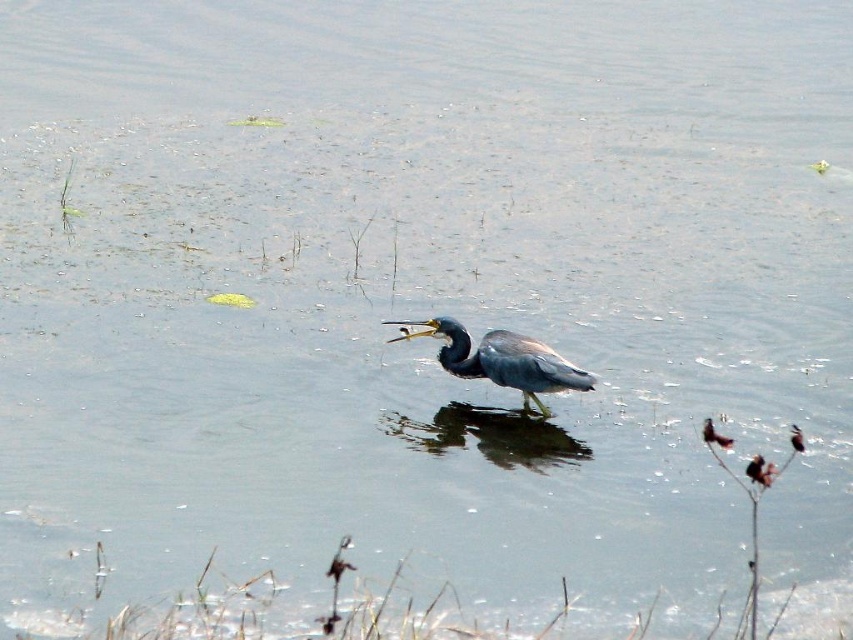
Between shiny black bird at center and gray matte bird at center, which one appears on the left side from the viewer's perspective?

shiny black bird at center is more to the left.

Where is `shiny black bird at center`? shiny black bird at center is located at coordinates [714, 435].

Who is positioned more to the right, shiny blue-gray heron at center or gray matte bird at center?

gray matte bird at center

Does shiny blue-gray heron at center have a lesser height compared to gray matte bird at center?

In fact, shiny blue-gray heron at center may be taller than gray matte bird at center.

Where is `shiny blue-gray heron at center`? This screenshot has width=853, height=640. shiny blue-gray heron at center is located at coordinates (502, 358).

This screenshot has width=853, height=640. Identify the location of shiny blue-gray heron at center. (502, 358).

Does point (479, 372) come closer to viewer compared to point (770, 470)?

No, it is behind (770, 470).

Is point (576, 385) less distant than point (757, 481)?

No, (576, 385) is behind (757, 481).

Identify the location of shiny blue-gray heron at center. (502, 358).